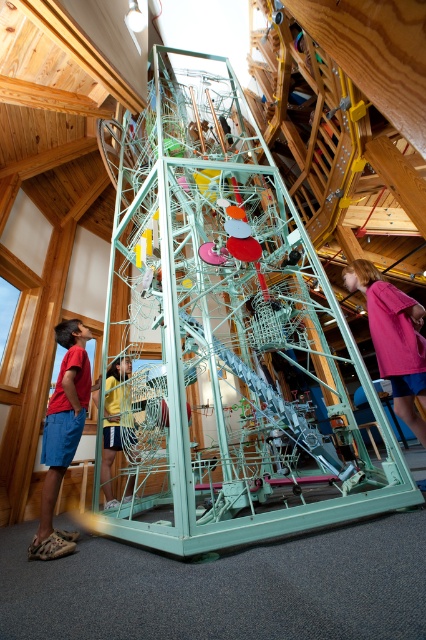
Question: Which point is farther to the camera?

Choices:
 (A) pyautogui.click(x=118, y=365)
 (B) pyautogui.click(x=406, y=317)
 (C) pyautogui.click(x=48, y=413)

Answer: (A)

Question: Which of these objects is positioned farthest from the matte red shirt at left?

Choices:
 (A) yellow fabric shorts at center
 (B) pink fabric shirt at lower right

Answer: (B)

Question: Which of the following is the farthest from the observer?

Choices:
 (A) pink fabric shirt at lower right
 (B) yellow fabric shorts at center

Answer: (B)

Question: Can you confirm if pink fabric shirt at lower right is positioned to the right of yellow fabric shorts at center?

Choices:
 (A) no
 (B) yes

Answer: (B)

Question: Does matte red shirt at left have a greater width compared to pink fabric shirt at lower right?

Choices:
 (A) yes
 (B) no

Answer: (A)

Question: Is matte red shirt at left to the right of yellow fabric shorts at center from the viewer's perspective?

Choices:
 (A) no
 (B) yes

Answer: (A)